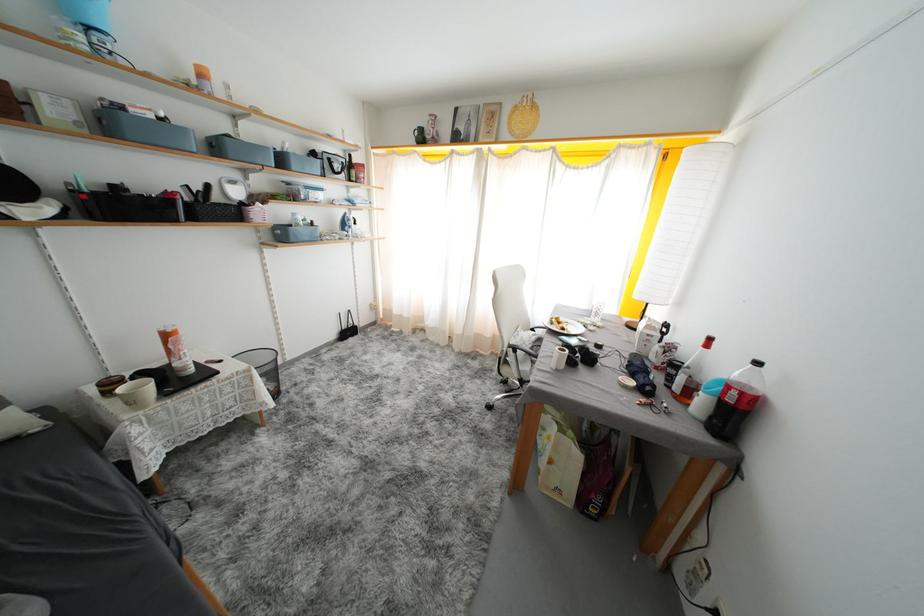
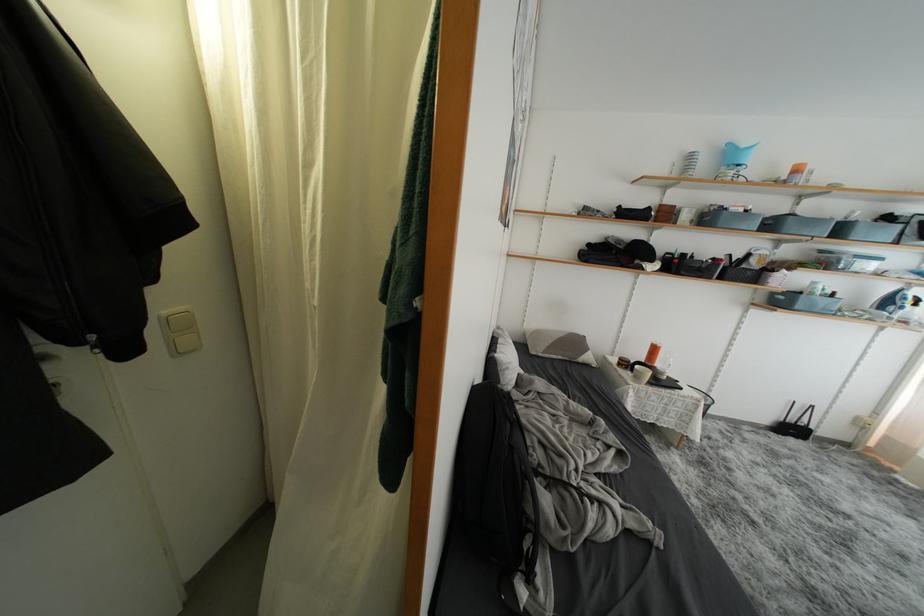
Where in the second image is the point corresponding to point (355, 336) from the first image?

(797, 434)